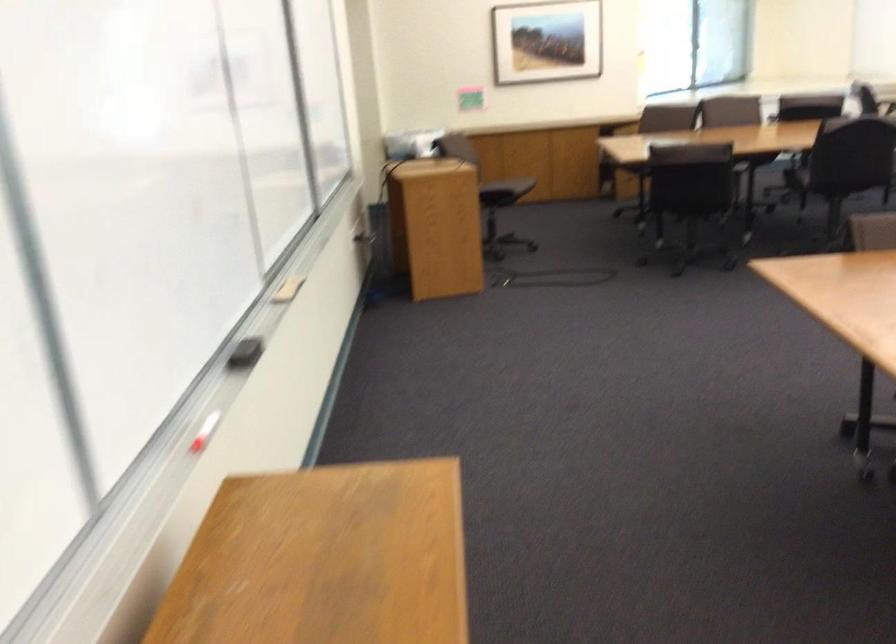
This screenshot has width=896, height=644. What do you see at coordinates (246, 353) in the screenshot?
I see `a black whiteboard eraser` at bounding box center [246, 353].